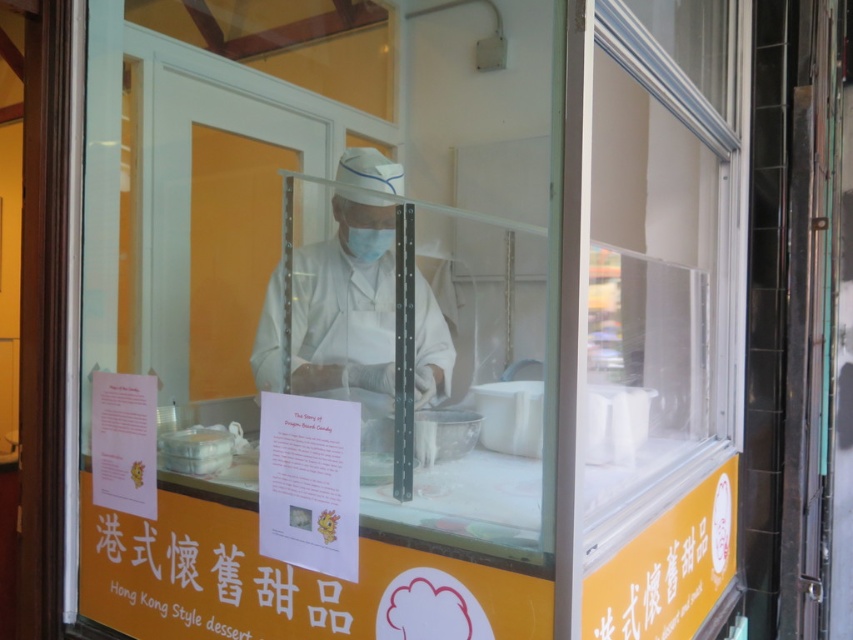
Consider the image. You are a customer at the food stall and want to read the orange paper sign at lower center. However, the white matte uniform at center of the staff member is blocking your view. Can you see the sign clearly?

The orange paper sign at lower center is shorter than the white matte uniform at center, so the uniform is taller and blocking the view of the sign.

You are a customer at the food stall and want to know which of the two points, point 1 at coordinates point 1 at coordinates point [125,576] or point 2 at coordinates point [396,172], is closer to you. Which one is closer?

Point [125,576] is closer to the camera than point [396,172], so the point at coordinates point [125,576] is closer to you.

You are a customer at the food stall and want to observe the chef preparing your dessert. Which object, the white matte uniform at center or the white matte mask at center, is closer to the top of the counter?

The white matte uniform at center is taller than the white matte mask at center, so the white matte uniform at center is closer to the top of the counter.